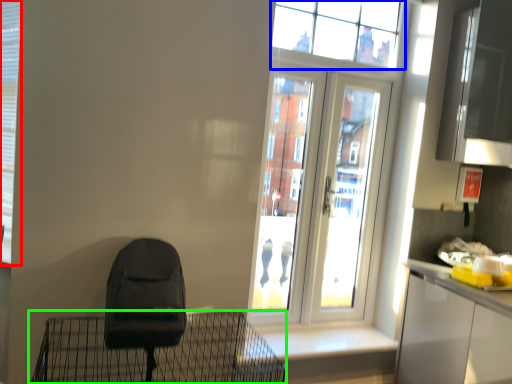
Question: Which is farther away from shutter (highlighted by a red box)? window (highlighted by a blue box) or furniture (highlighted by a green box)?

Choices:
 (A) window
 (B) furniture

Answer: (A)